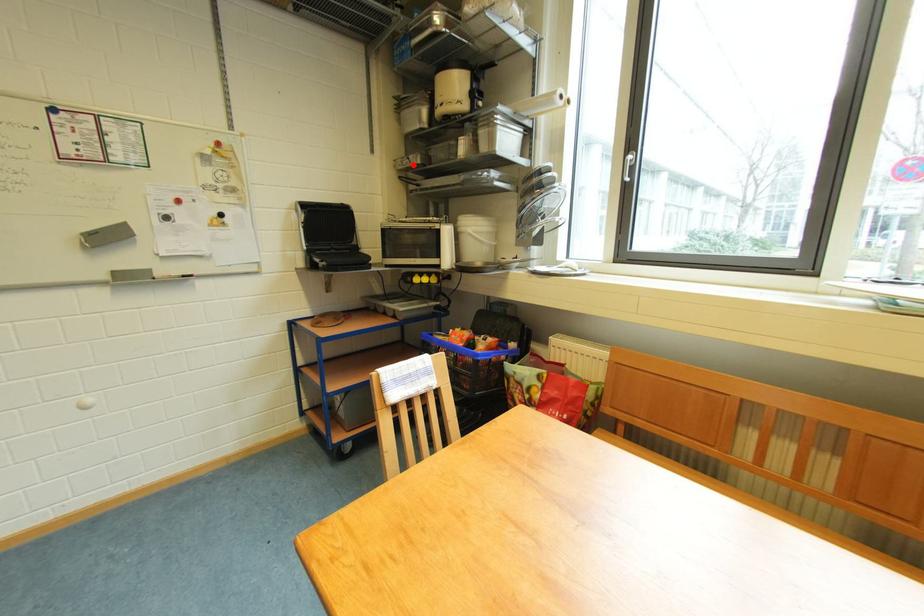
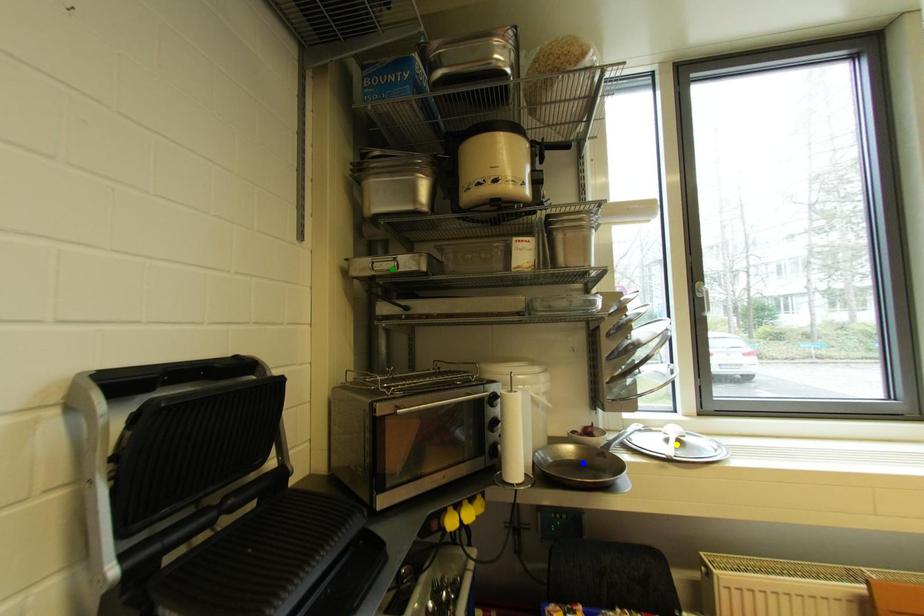
Question: I am providing you with two images of the same scene from different viewpoints. A red point is marked on the first image. You are given multiple points on the second image. Which point in image 2 is actually the same real-world point as the red point in image 1?

Choices:
 (A) blue point
 (B) green point
 (C) yellow point

Answer: (B)